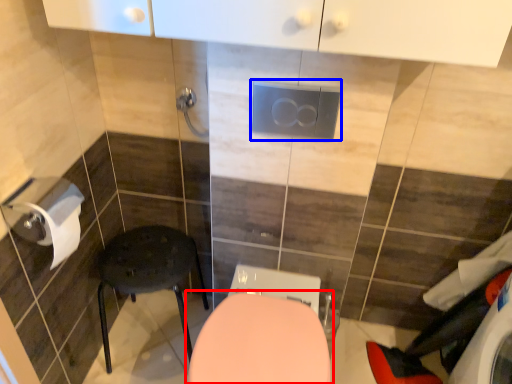
Question: Among these objects, which one is nearest to the camera, toilet (highlighted by a red box) or electric outlet (highlighted by a blue box)?

Choices:
 (A) toilet
 (B) electric outlet

Answer: (A)